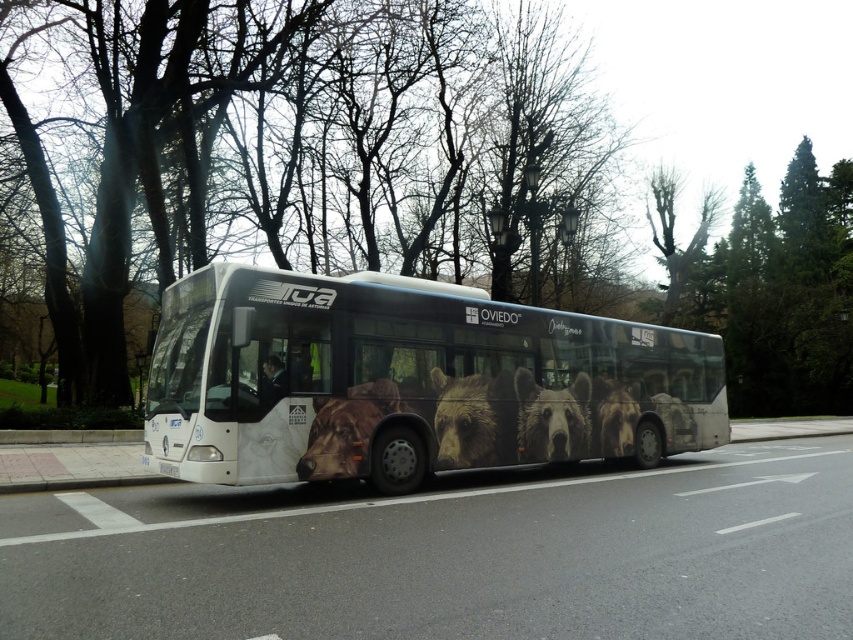
In the scene shown: You are a pedestrian standing on the sidewalk next to the white metallic bus at center. You want to see the white plastic license plate at lower center. In which direction should you look?

The white metallic bus at center is located above the white plastic license plate at lower center, so you should look downward to see the white plastic license plate at lower center.

You are a pedestrian standing on the sidewalk looking at the bus. Which object is higher up from the ground, the green leafy tree at center or the white plastic license plate at lower center?

The green leafy tree at center is above the white plastic license plate at lower center, so the green leafy tree at center is higher up from the ground.

Consider the image. You are a photographer trying to capture the entire white metallic bus at center and the white plastic license plate at lower center in one shot. However, your camera has a limited zoom range. Based on their sizes, which object should you focus on first to ensure both are visible in the frame?

The white metallic bus at center is bigger than the white plastic license plate at lower center, so you should focus on the white metallic bus at center first to ensure both are visible in the frame.